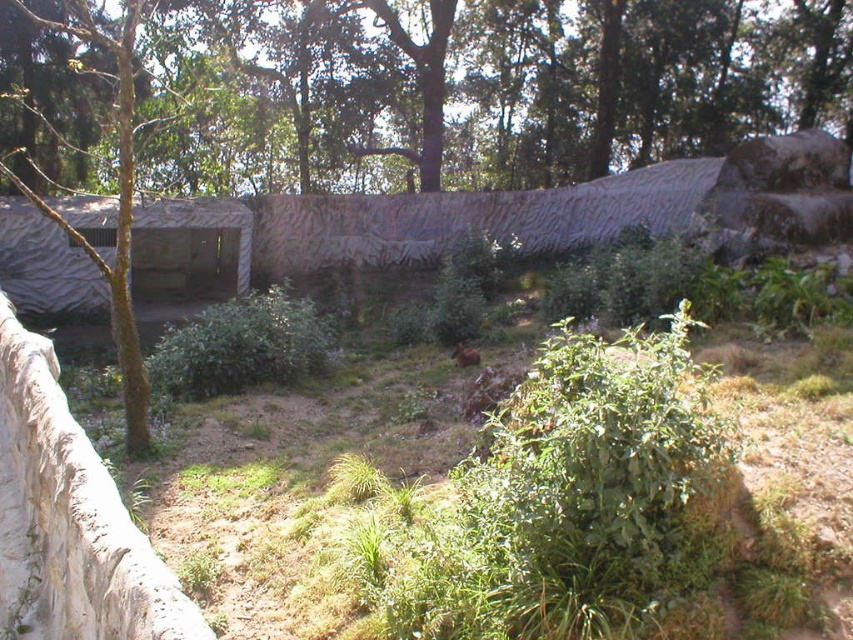
You are a zoo visitor standing in the enclosure. You want to take a photo of the camouflage fabric hut at left without the green leafy tree at center blocking the view. Is there a position where you can do this?

The green leafy tree at center is in front of the camouflage fabric hut at left, so you can move to the side of the tree to get a clear view of the camouflage fabric hut at left without the tree blocking the view.

In the scene shown: You are a zookeeper standing at the entrance of the enclosure. You need to observe the brown fur animal at center and the green leafy tree at center. Which object is positioned higher in the enclosure?

The green leafy tree at center is located above the brown fur animal at center, so it is positioned higher in the enclosure.